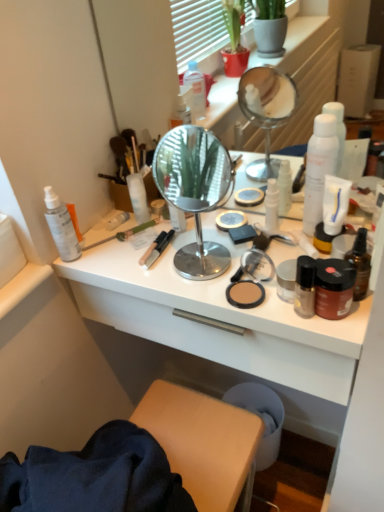
Find the location of `vacant space that is in between translucent plastic spray bottle at left, which is the eighth toiletry in right-to-left order, and brown glass bottle at right, which is counted as the second bottle, starting from the back`. vacant space that is in between translucent plastic spray bottle at left, which is the eighth toiletry in right-to-left order, and brown glass bottle at right, which is counted as the second bottle, starting from the back is located at coordinates [156, 269].